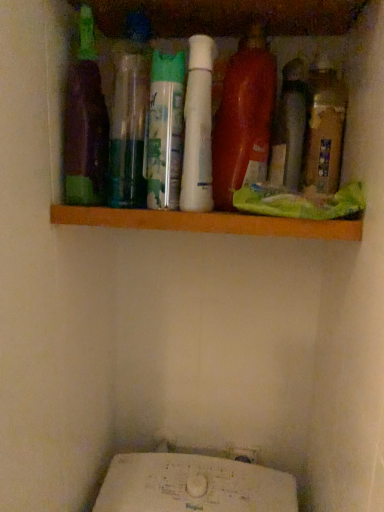
Question: From the image's perspective, is brown matte bottle at right, which is counted as the 1th bottle, starting from the right, positioned above or below purple matte bottle at left, which is the seventh bottle from right to left?

Choices:
 (A) above
 (B) below

Answer: (B)

Question: Looking at their shapes, would you say brown matte bottle at right, which ranks as the 7th bottle in left-to-right order, is wider or thinner than purple matte bottle at left, which is the seventh bottle from right to left?

Choices:
 (A) wide
 (B) thin

Answer: (B)

Question: Based on their relative distances, which object is farther from the brown matte bottle at right, which is counted as the 1th bottle, starting from the right?

Choices:
 (A) purple matte bottle at left, the 1th bottle when ordered from left to right
 (B) wooden shelf at upper center
 (C) green matte spray can at center, positioned as the 2th bottle in left-to-right order
 (D) white matte bottle at center, the fourth bottle from the right
 (E) matte gray bottle at center-right, marked as the sixth bottle in a left-to-right arrangement

Answer: (A)

Question: Which object is the farthest from the wooden shelf at upper center?

Choices:
 (A) matte gray bottle at center-right, marked as the second bottle in a right-to-left arrangement
 (B) shiny orange bottle at center, the 3th bottle viewed from the right
 (C) green matte spray can at center, the sixth bottle in the right-to-left sequence
 (D) brown matte bottle at right, which ranks as the 7th bottle in left-to-right order
 (E) purple matte bottle at left, the 1th bottle when ordered from left to right

Answer: (D)